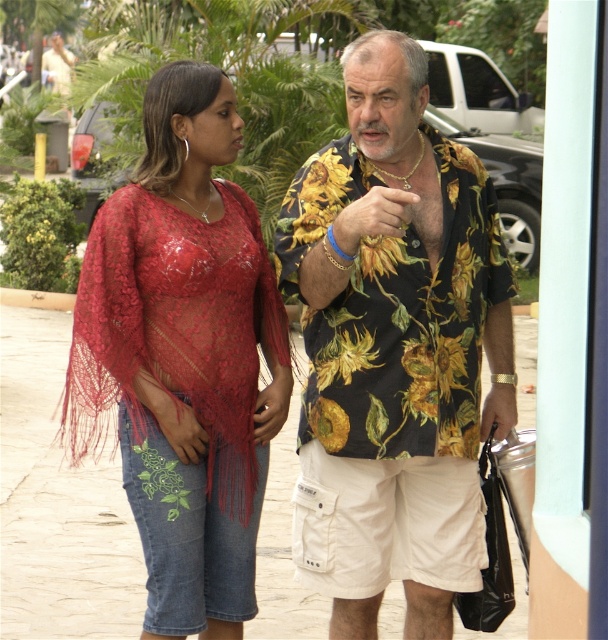
You are standing in the scene and want to walk towards both the point at coordinates point (280, 515) and the point at coordinates point (178, 529). Which point will you reach first?

You will reach point (280, 515) first because it is closer to you than point (178, 529).

You are a photographer trying to capture a closeup of the gold metallic bracelet at upper center without including the lace fabric top at left in the frame. Is this possible given their positions?

The lace fabric top at left is positioned on the left side of the gold metallic bracelet at upper center, meaning the bracelet is to the right of the top. If you position your camera to frame only the right side where the bracelet is located, you can exclude the lace fabric top at left.